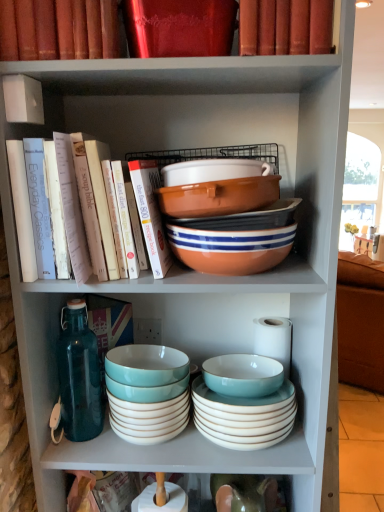
What are the coordinates of `vacant space situated above matte orange bowl at center, which ranks as the sixth bowl in bottom-to-top order (from a real-world perspective)` in the screenshot? It's located at (228, 169).